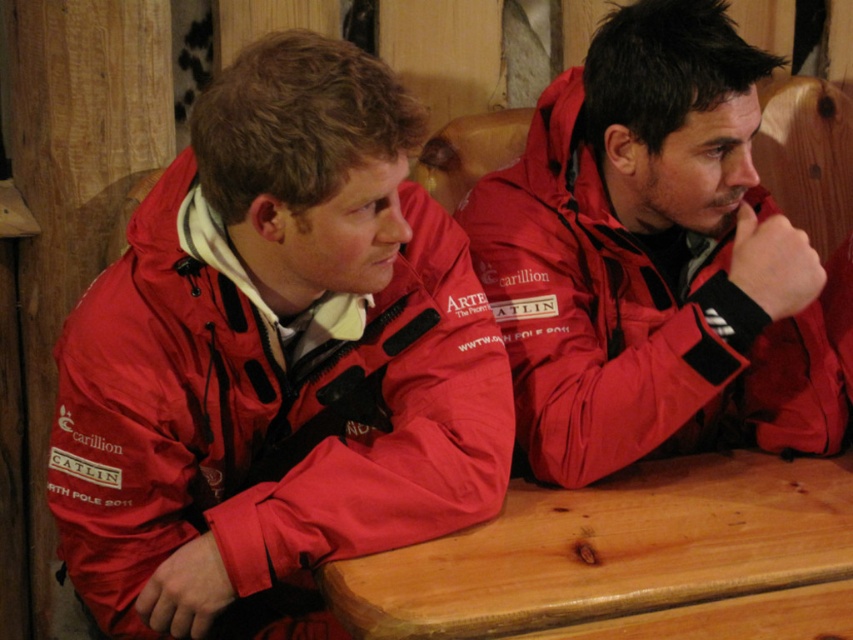
Between matte red jacket at center and wooden table at center, which one has more height?

matte red jacket at center

Is point (538, 163) farther from camera compared to point (677, 531)?

Yes, point (538, 163) is behind point (677, 531).

Identify the location of matte red jacket at center. The width and height of the screenshot is (853, 640). (631, 323).

Image resolution: width=853 pixels, height=640 pixels. Describe the element at coordinates (268, 417) in the screenshot. I see `matte red jacket at left` at that location.

Is matte red jacket at left positioned at the back of matte red jacket at center?

No, it is in front of matte red jacket at center.

Image resolution: width=853 pixels, height=640 pixels. What do you see at coordinates (268, 417) in the screenshot?
I see `matte red jacket at left` at bounding box center [268, 417].

Locate an element on the screen. The height and width of the screenshot is (640, 853). matte red jacket at left is located at coordinates (268, 417).

Is matte red jacket at left above wooden table at center?

Indeed, matte red jacket at left is positioned over wooden table at center.

Is matte red jacket at left positioned in front of wooden table at center?

That is False.

Describe the element at coordinates (268, 417) in the screenshot. I see `matte red jacket at left` at that location.

Image resolution: width=853 pixels, height=640 pixels. What are the coordinates of `matte red jacket at left` in the screenshot? It's located at (268, 417).